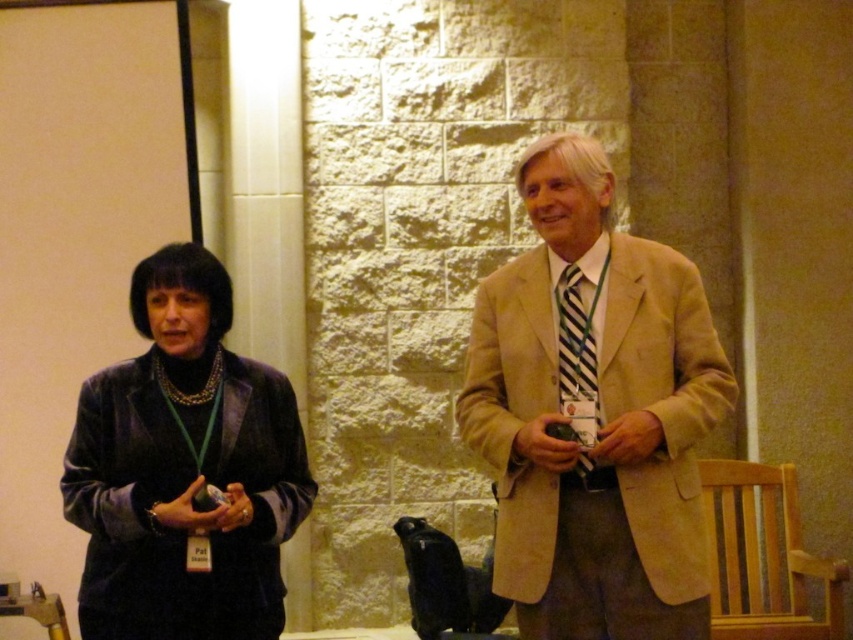
Question: Considering the real-world distances, which object is farthest from the velvet black jacket at center?

Choices:
 (A) beige wool suit at center
 (B) velvet black jacket at left

Answer: (B)

Question: Does velvet black jacket at center appear over beige wool suit at center?

Choices:
 (A) yes
 (B) no

Answer: (A)

Question: Does velvet black jacket at center appear on the left side of velvet black jacket at left?

Choices:
 (A) yes
 (B) no

Answer: (B)

Question: Which object is the farthest from the velvet black jacket at center?

Choices:
 (A) velvet black jacket at left
 (B) beige wool suit at center

Answer: (A)

Question: Which point is farther from the camera taking this photo?

Choices:
 (A) (695, 612)
 (B) (154, 256)

Answer: (B)

Question: Does velvet black jacket at center come in front of beige wool suit at center?

Choices:
 (A) yes
 (B) no

Answer: (A)